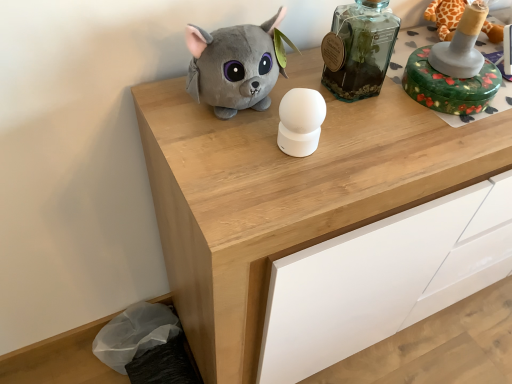
This screenshot has height=384, width=512. What are the coordinates of `vacant space in soft plush cat at upper center, which is the 1th toy in left-to-right order (from a real-world perspective)` in the screenshot? It's located at (230, 112).